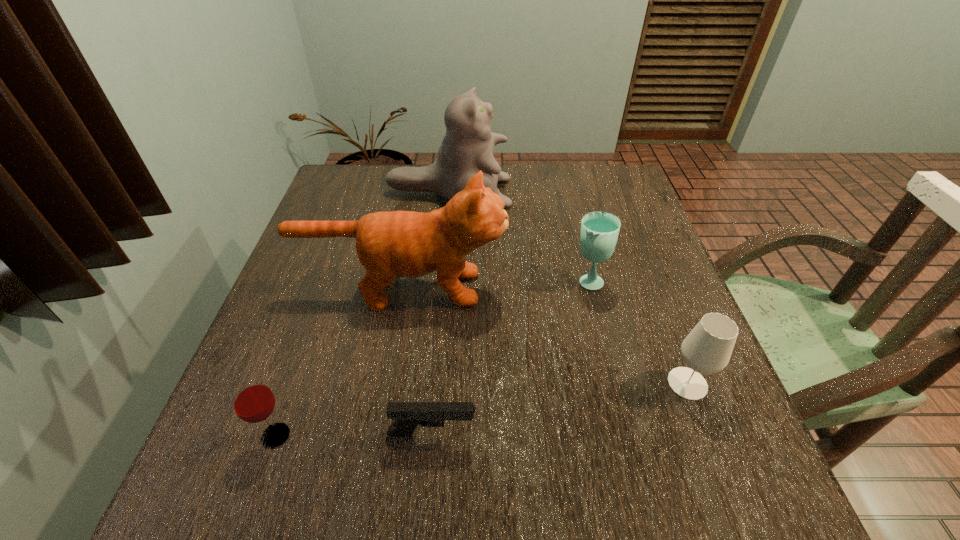
The image size is (960, 540). I want to click on free space at the near right corner, so click(681, 493).

You are a GUI agent. You are given a task and a screenshot of the screen. Output one action in this format:
    pyautogui.click(x=<x>, y=<y>)
    Task: Click on the unoccupied area between the leftmost glass and the nearer cat
    Image resolution: width=960 pixels, height=540 pixels.
    Given the screenshot: What is the action you would take?
    pyautogui.click(x=339, y=362)

This screenshot has width=960, height=540. I want to click on empty space that is in between the pistol and the farthest object, so click(x=441, y=314).

Where is `free area in between the rightmost object and the nearest glass`? The height and width of the screenshot is (540, 960). free area in between the rightmost object and the nearest glass is located at coordinates (482, 409).

In order to click on empty location between the nearer cat and the pistol in this screenshot , I will do `click(418, 362)`.

You are a GUI agent. You are given a task and a screenshot of the screen. Output one action in this format:
    pyautogui.click(x=<x>, y=<y>)
    Task: Click on the free space between the farthest glass and the rightmost object
    The image size is (960, 540).
    Given the screenshot: What is the action you would take?
    pyautogui.click(x=637, y=332)

What are the coordinates of `vacant area that lies between the shortest object and the nearer cat` in the screenshot? It's located at (418, 362).

This screenshot has height=540, width=960. I want to click on free space that is in between the second glass from right to left and the shortest object, so click(510, 358).

The image size is (960, 540). Identify the location of free space that is in between the farther cat and the farthest glass. (518, 237).

Where is `empty space between the leftmost glass and the fourth farthest object`? This screenshot has width=960, height=540. empty space between the leftmost glass and the fourth farthest object is located at coordinates (482, 409).